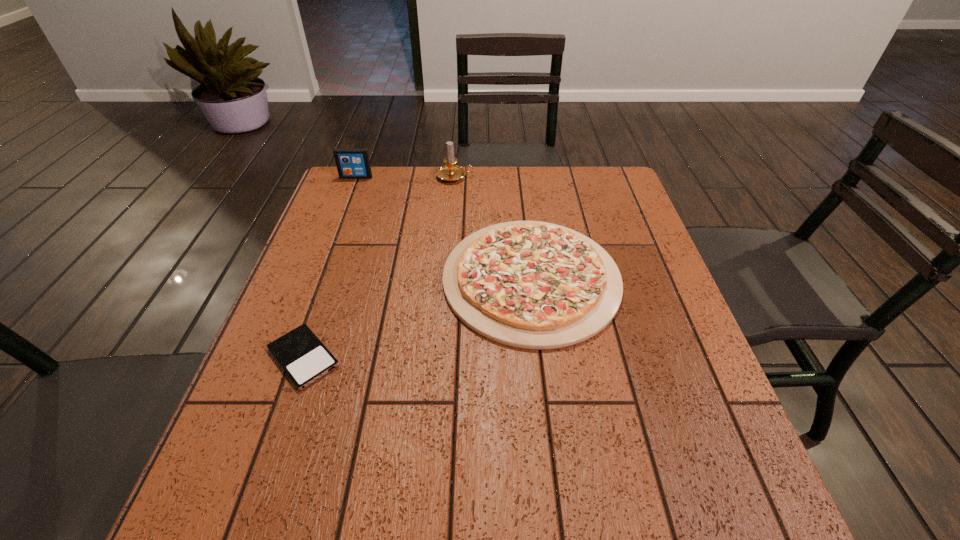
Locate an element on the screen. candle is located at coordinates (450, 172).

Find the location of a particular element. This screenshot has width=960, height=540. the taller iPod is located at coordinates [x=352, y=163].

Find the location of a particular element. The height and width of the screenshot is (540, 960). the second tallest object is located at coordinates (352, 163).

Locate an element on the screen. the third tallest object is located at coordinates (535, 285).

Where is `the nearer iPod`? This screenshot has width=960, height=540. the nearer iPod is located at coordinates (304, 358).

Locate an element on the screen. This screenshot has height=540, width=960. the shorter iPod is located at coordinates (304, 358).

The height and width of the screenshot is (540, 960). In order to click on vacant space located 0.310m on the right of the tallest object in this screenshot , I will do `click(569, 177)`.

Locate an element on the screen. vacant space located on the front screen of the taller iPod is located at coordinates (343, 212).

Find the location of a particular element. This screenshot has width=960, height=540. blank space located on the left of the pizza is located at coordinates (321, 279).

Locate an element on the screen. The image size is (960, 540). free space located on the back of the shortest object is located at coordinates coord(323,305).